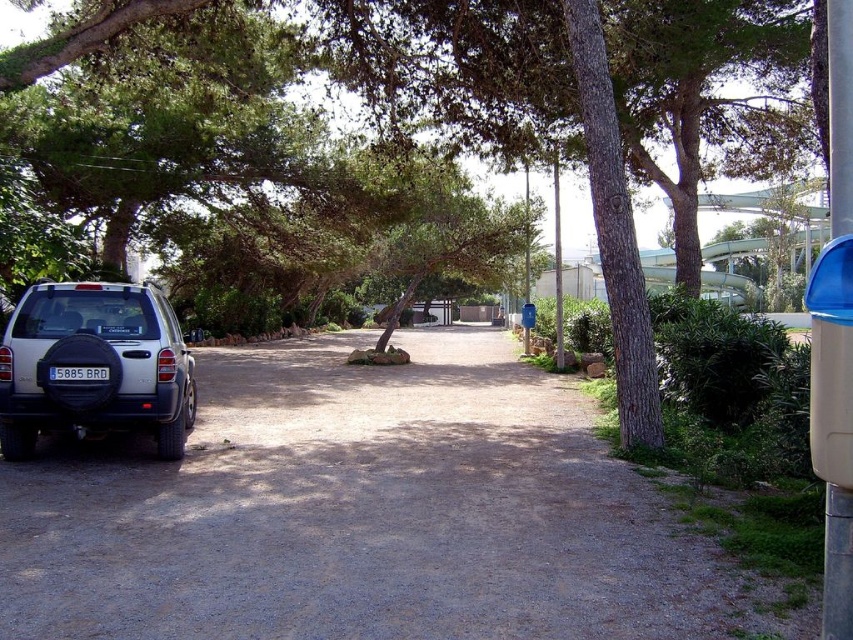
You are a photographer setting up a tripod in the parking area. You want to capture both the green leafy tree at center and the blue matte license plate at lower left in your shot. Which object will appear taller in the photo?

The green leafy tree at center will appear taller in the photo because it has a greater height compared to the blue matte license plate at lower left.

You are a delivery person trying to park your van in this parking area. You see the green leafy tree at center and the satin silver suv at lower left. Which object is wider? Please answer based on the scene description.

The green leafy tree at center is wider than the satin silver suv at lower left according to the scene description.

You are a delivery person trying to park your van next to the gray asphalt driveway at lower left and the satin silver suv at lower left. Since your van is 5 meters long, can you fit it between them without overlapping?

The gray asphalt driveway at lower left is shorter than the satin silver suv at lower left. However, the total length available between them depends on their combined dimensions. Since the SUV is longer than the driveway, there might not be enough space. Without exact measurements, it is uncertain if the 5 meter van can fit. Please check the actual length of the driveway and SUV first.